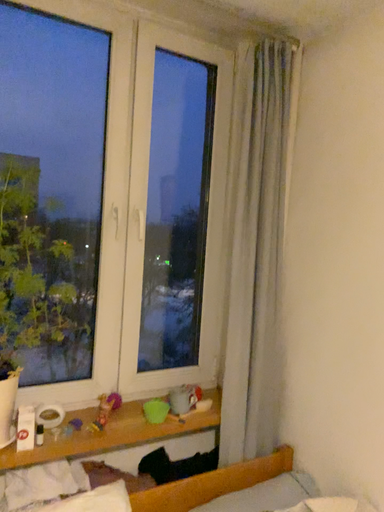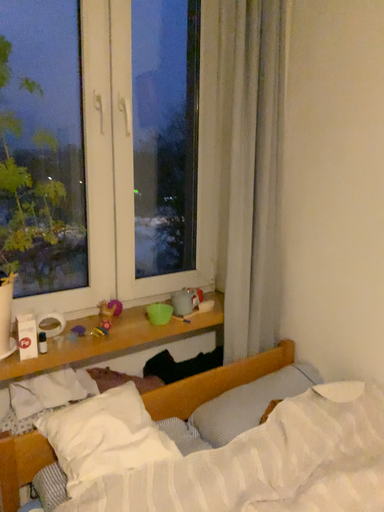
Question: Which way did the camera rotate in the video?

Choices:
 (A) rotated downward
 (B) rotated upward

Answer: (A)